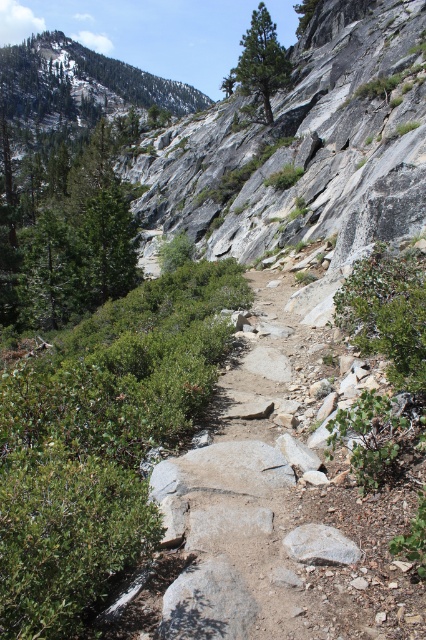
You are a hiker standing on the trail and want to take a photo of both the green leafy tree at left and the green textured pine tree at upper center. Which tree should you focus on first to ensure both are in the frame?

You should focus on the green leafy tree at left first because it is closer to you than the green textured pine tree at upper center, so adjusting the camera to include both would require framing starting from the closer one.

You are a hiker planning to take a photo of the green leafy shrub at upper right and the green textured pine tree at upper center. Which one should you focus on first if you want to capture both in the same frame without moving the camera?

The green leafy shrub at upper right is shorter than the green textured pine tree at upper center, so you should focus on the green textured pine tree at upper center first since it is taller and will be more prominent in the frame.